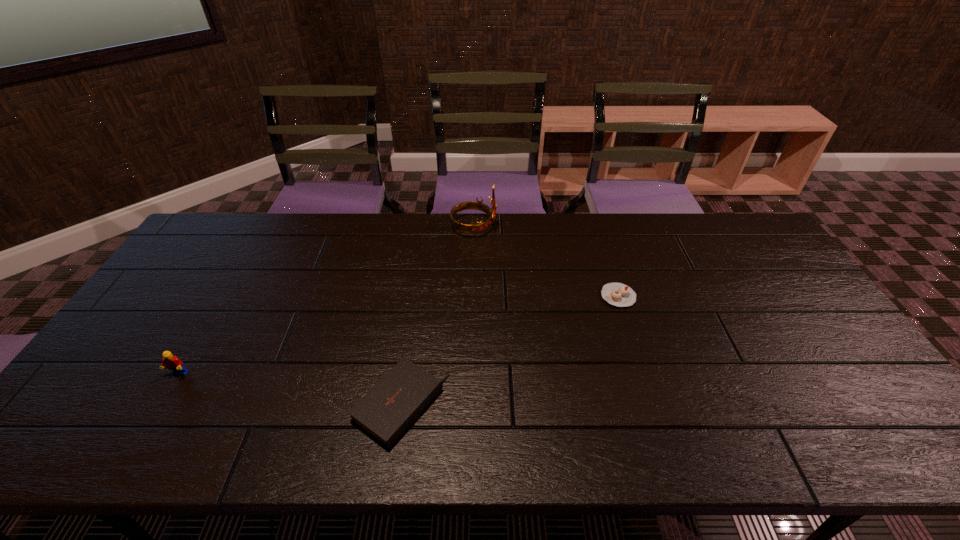
Image resolution: width=960 pixels, height=540 pixels. What are the coordinates of `vacant area between the third shortest object and the tiara` in the screenshot? It's located at (326, 301).

Where is `vacant region between the cupcake and the Lego`? The height and width of the screenshot is (540, 960). vacant region between the cupcake and the Lego is located at coordinates (398, 335).

Find the location of a particular element. The height and width of the screenshot is (540, 960). empty space that is in between the Bible and the tallest object is located at coordinates (438, 316).

At what (x,y) coordinates should I click in order to perform the action: click on free spot between the third shortest object and the farthest object. Please return your answer as a coordinate pair (x, y). Looking at the image, I should click on (326, 301).

I want to click on free space between the tiara and the third shortest object, so click(326, 301).

Identify the location of free space between the Bible and the Lego. This screenshot has width=960, height=540. (290, 390).

At what (x,y) coordinates should I click in order to perform the action: click on free point between the Bible and the Lego. Please return your answer as a coordinate pair (x, y). This screenshot has width=960, height=540. Looking at the image, I should click on (290, 390).

Where is `vacant area that lies between the second farthest object and the tiara`? This screenshot has height=540, width=960. vacant area that lies between the second farthest object and the tiara is located at coordinates (546, 261).

Where is `free space between the rightmost object and the Bible`? This screenshot has height=540, width=960. free space between the rightmost object and the Bible is located at coordinates (510, 350).

Locate an element on the screen. The height and width of the screenshot is (540, 960). vacant space that's between the farthest object and the leftmost object is located at coordinates (326, 301).